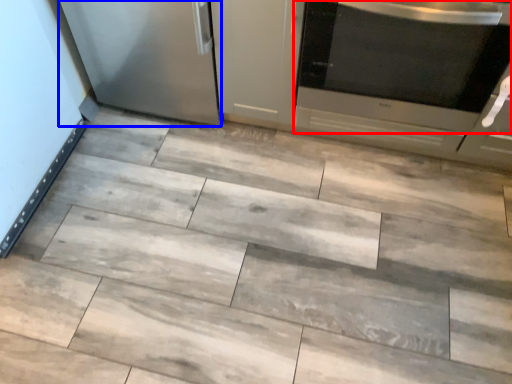
Question: Among these objects, which one is farthest to the camera, home appliance (highlighted by a red box) or appliance (highlighted by a blue box)?

Choices:
 (A) home appliance
 (B) appliance

Answer: (B)